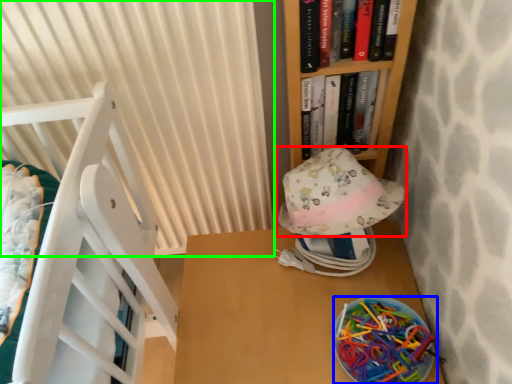
Question: Which is farther away from hat (highlighted by a red box)? stuff (highlighted by a blue box) or curtain (highlighted by a green box)?

Choices:
 (A) stuff
 (B) curtain

Answer: (B)